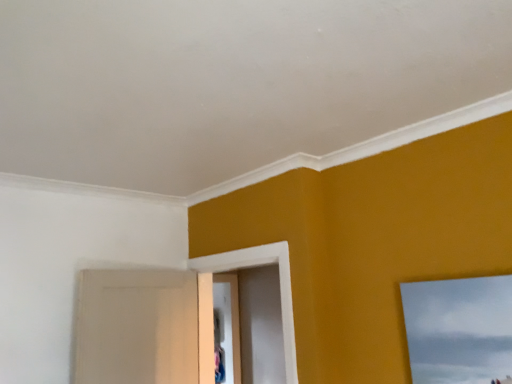
Question: Should I look upward or downward to see white matte door at center?

Choices:
 (A) down
 (B) up

Answer: (A)